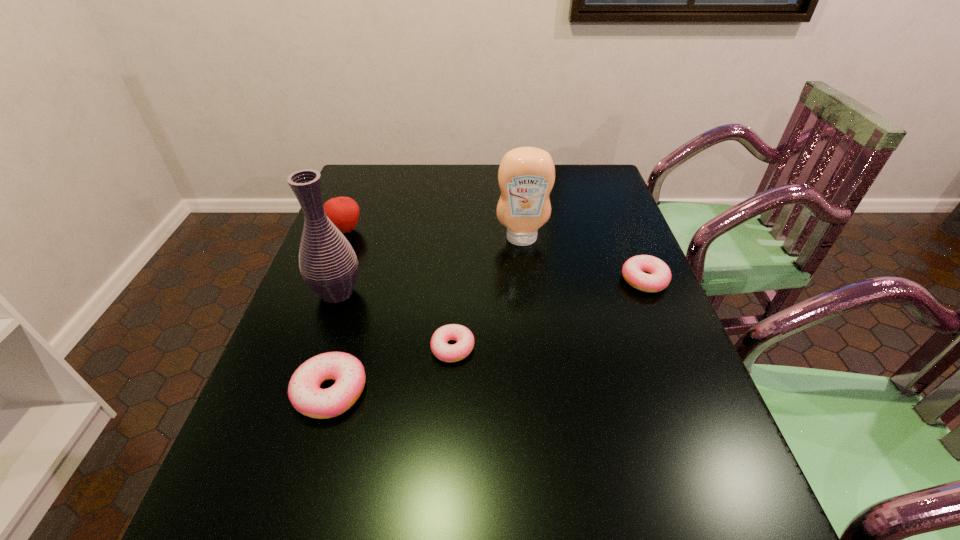
If equal spacing is the goal by inserting an additional doughnut among them, please point out a vacant space for this new doughnut. Please provide its 2D coordinates. Your answer should be formatted as a tuple, i.e. [(x, y)], where the tuple contains the x and y coordinates of a point satisfying the conditions above.

[(556, 311)]